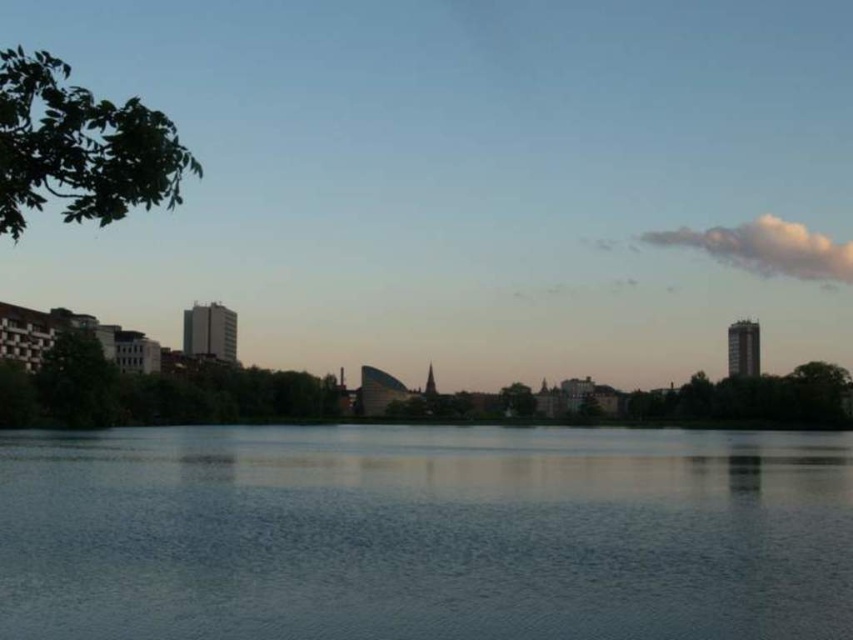
You are a photographer planning to capture the reflection of the green leafy tree at center in the smooth water at center. Based on the scene, can you confirm if the tree is visible in the water?

The smooth water at center is positioned over green leafy tree at center, which means the tree is likely reflected in the water since the water is above it and calm enough to reflect.

You are an architect analyzing the urban landscape. You notice the smooth water at center and the green leafy branch at upper left. Which of these two elements occupies a larger area in the scene?

The green leafy branch at upper left is larger than the smooth water at center.